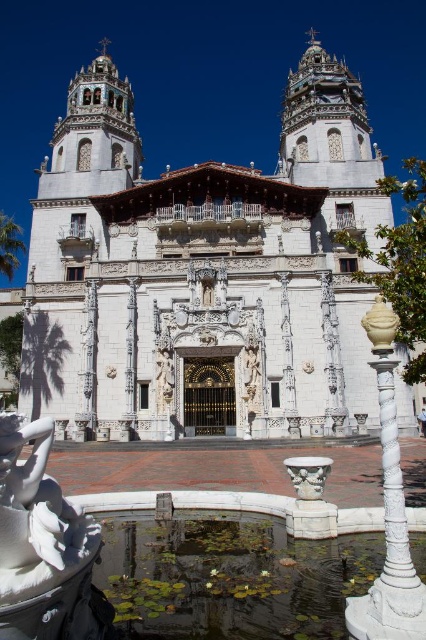
You are standing in front of the Hearst Castle and want to take a photo of both the white marble church at center and the white marble statue at lower left. Based on their positions, which one should you include on the left side of your photo?

The white marble church at center is to the left of the white marble statue at lower left, so to include both in your photo, the white marble church at center should be on the left side and the white marble statue at lower left on the right side.

You are standing at the entrance of the Hearst Castle and notice two points marked on the ground. The first point is labeled as point (x=164, y=346) and the second is point (x=0, y=580). If you were to walk from the entrance towards the first point, would you pass the second point before reaching the first one?

Yes, you would pass point (x=0, y=580) before reaching point (x=164, y=346) because point (x=164, y=346) is behind point (x=0, y=580).

You are standing at the entrance of the Hearst Castle and notice a green leafy pond at lower center and a white marble statue at lower left. Which object is closer to you from your current position?

The green leafy pond at lower center is closer to you because the white marble statue at lower left is behind it.